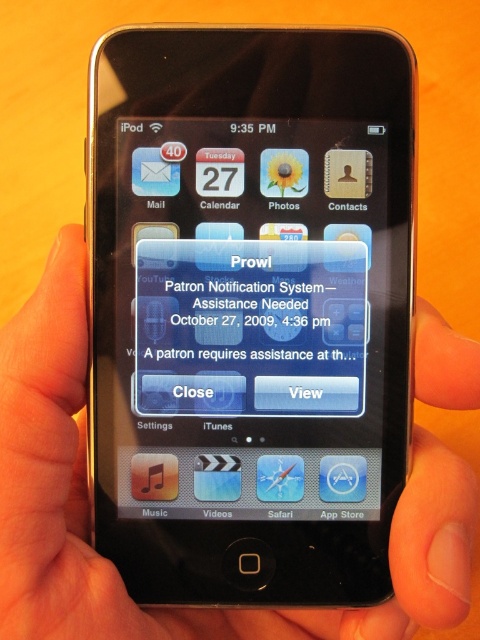
You are a person who wants to read the text message displayed on the iPod touch. Based on the scene, can you easily read the white matte text message at center without moving the black matte hand at center that is holding the device?

The black matte hand at center is much taller than the white matte text message at center, so the hand is likely covering part of the screen where the text message is displayed. Therefore, you would need to move the hand to read the message clearly.

You are a person who just received a text message on your phone. You want to read the message but your hand is blocking part of the screen. Which object, the black matte hand at center or the white matte text message at center, is in the way of reading the message?

The black matte hand at center is to the left of the white matte text message at center, so the hand is blocking part of the message. Move the hand to the right to read the message.